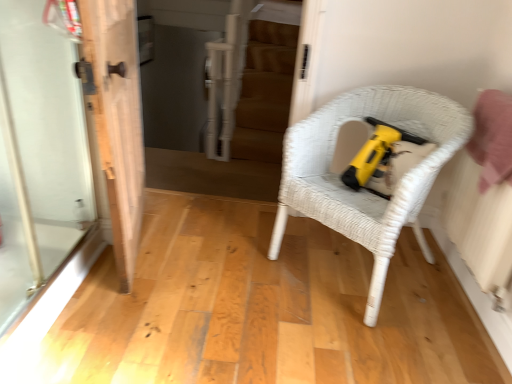
Find the location of a particular element. The image size is (512, 384). vacant area located to the right-hand side of white wood door at left is located at coordinates (208, 254).